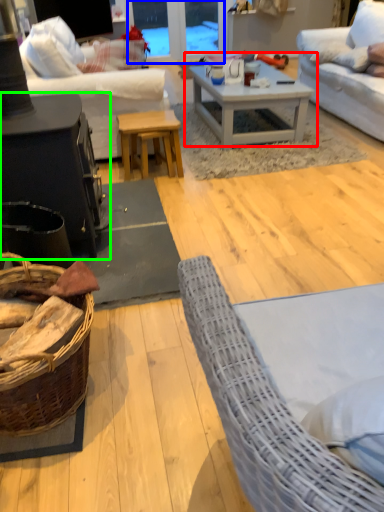
Question: Which object is the farthest from coffee table (highlighted by a red box)? Choose among these: glass door (highlighted by a blue box) or table (highlighted by a green box).

Choices:
 (A) glass door
 (B) table

Answer: (A)